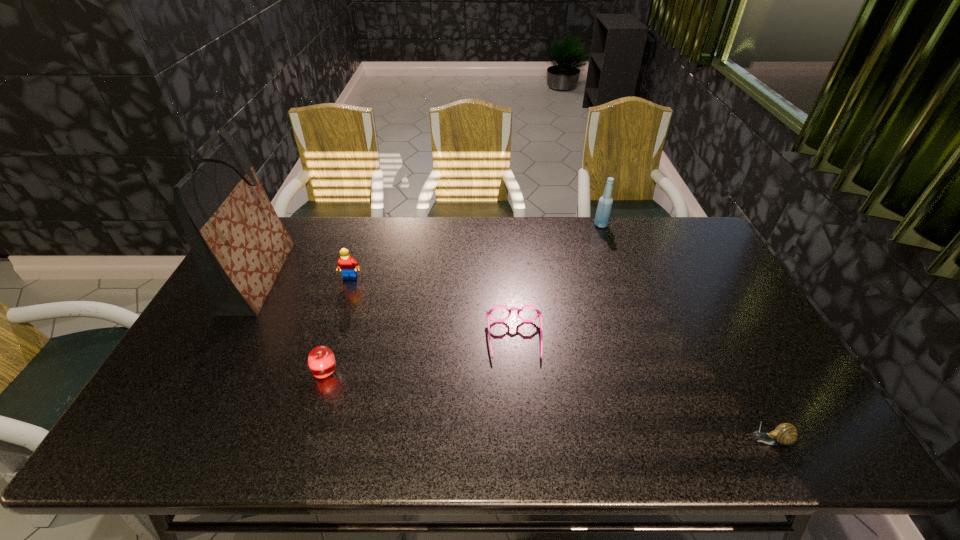
Identify the location of object positioned at the left edge. (240, 245).

Locate an element on the screen. Image resolution: width=960 pixels, height=540 pixels. object that is at the right edge is located at coordinates tap(784, 434).

The image size is (960, 540). In order to click on object located in the far left corner section of the desktop in this screenshot , I will do `click(240, 245)`.

The image size is (960, 540). In order to click on object located in the near right corner section of the desktop in this screenshot , I will do `click(784, 434)`.

Where is `vacant area at the far edge`? vacant area at the far edge is located at coordinates (552, 251).

In the image, there is a desktop. Identify the location of vacant space at the near edge. This screenshot has width=960, height=540. (338, 430).

In the image, there is a desktop. Where is `vacant space at the left edge`? vacant space at the left edge is located at coordinates (201, 333).

Find the location of `free region at the right edge of the desktop`. free region at the right edge of the desktop is located at coordinates pos(692,269).

The height and width of the screenshot is (540, 960). In the image, there is a desktop. In order to click on free space at the near left corner in this screenshot , I will do `click(178, 423)`.

At what (x,y) coordinates should I click in order to perform the action: click on vacant point at the far right corner. Please return your answer as a coordinate pair (x, y). Image resolution: width=960 pixels, height=540 pixels. Looking at the image, I should click on (657, 219).